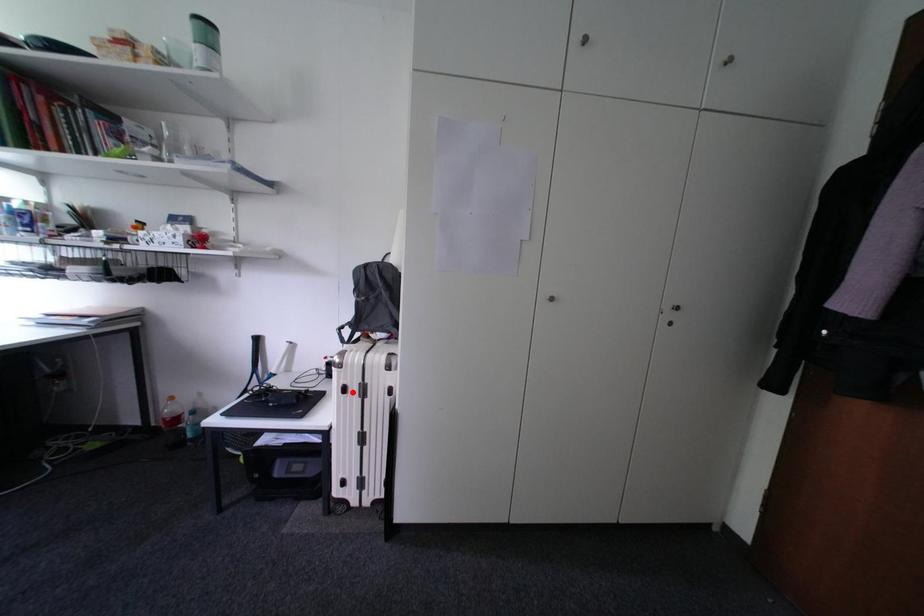
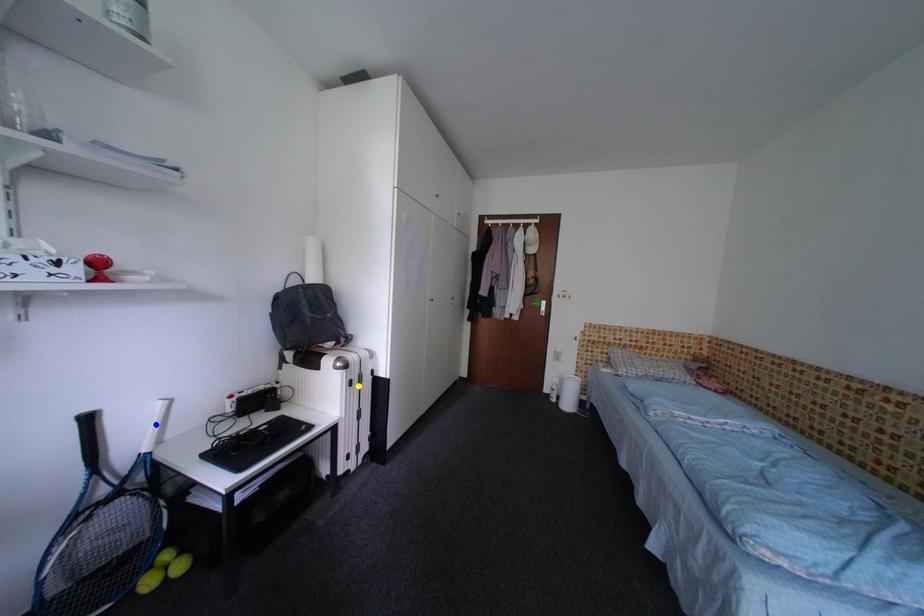
Question: I am providing you with two images of the same scene from different viewpoints. A red point is marked on the first image. You are given multiple points on the second image. Which mark in image 2 goes with the point in image 1?

Choices:
 (A) blue point
 (B) yellow point
 (C) green point

Answer: (B)